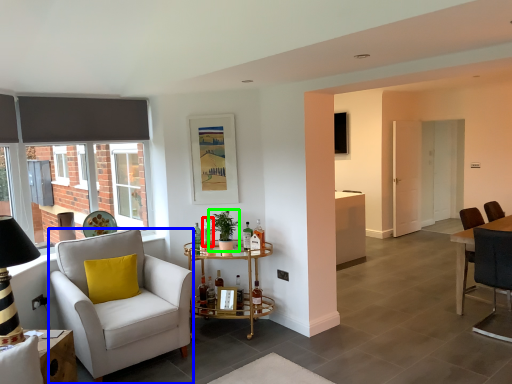
Question: Which is nearer to the bottle (highlighted by a red box)? chair (highlighted by a blue box) or houseplant (highlighted by a green box).

Choices:
 (A) chair
 (B) houseplant

Answer: (B)